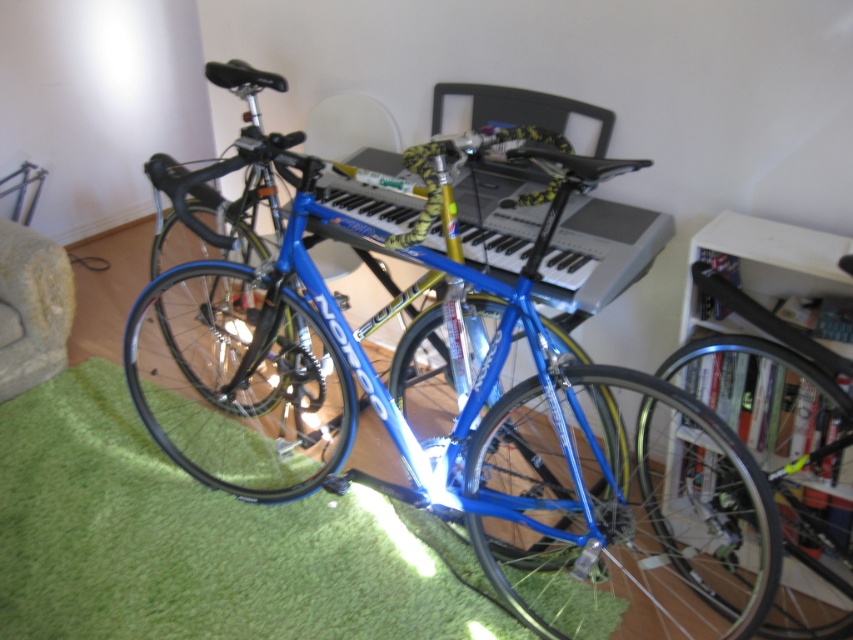
Based on the photo, does blue metallic bicycle at center have a lesser width compared to yellow-green textured piano at center?

In fact, blue metallic bicycle at center might be wider than yellow-green textured piano at center.

Locate an element on the screen. blue metallic bicycle at center is located at coordinates (457, 404).

Who is more distant from viewer, (253,326) or (579,212)?

Positioned behind is point (253,326).

Where is `blue metallic bicycle at center`? This screenshot has height=640, width=853. blue metallic bicycle at center is located at coordinates (457, 404).

Can you confirm if blue metallic bicycle at center is taller than white cardboard at upper right?

Correct, blue metallic bicycle at center is much taller as white cardboard at upper right.

Image resolution: width=853 pixels, height=640 pixels. What do you see at coordinates (457, 404) in the screenshot?
I see `blue metallic bicycle at center` at bounding box center [457, 404].

Identify the location of blue metallic bicycle at center. The width and height of the screenshot is (853, 640). (457, 404).

Does white cardboard at upper right appear on the right side of yellow-green textured piano at center?

Indeed, white cardboard at upper right is positioned on the right side of yellow-green textured piano at center.

Is white cardboard at upper right positioned in front of yellow-green textured piano at center?

No, it is behind yellow-green textured piano at center.

Where is `white cardboard at upper right`? Image resolution: width=853 pixels, height=640 pixels. white cardboard at upper right is located at coordinates click(x=782, y=406).